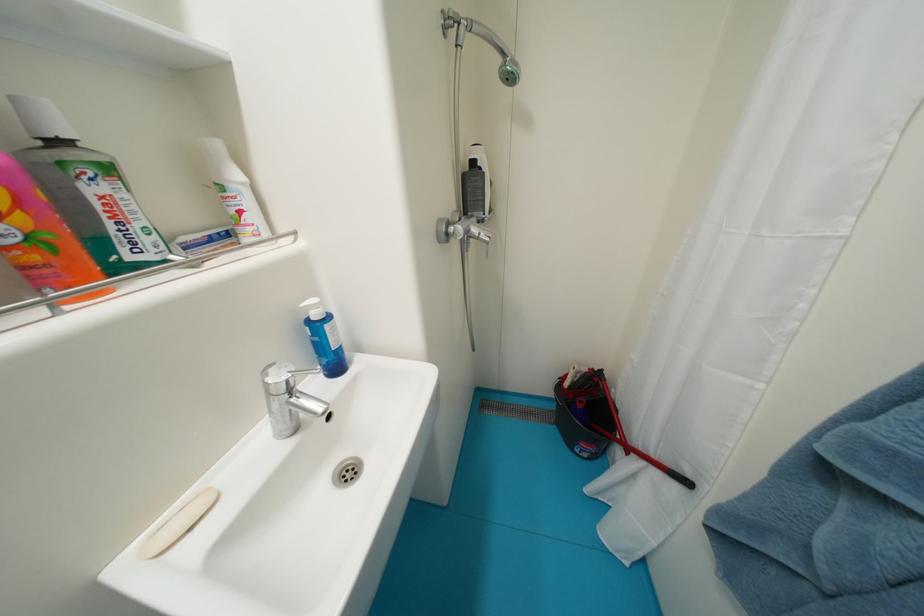
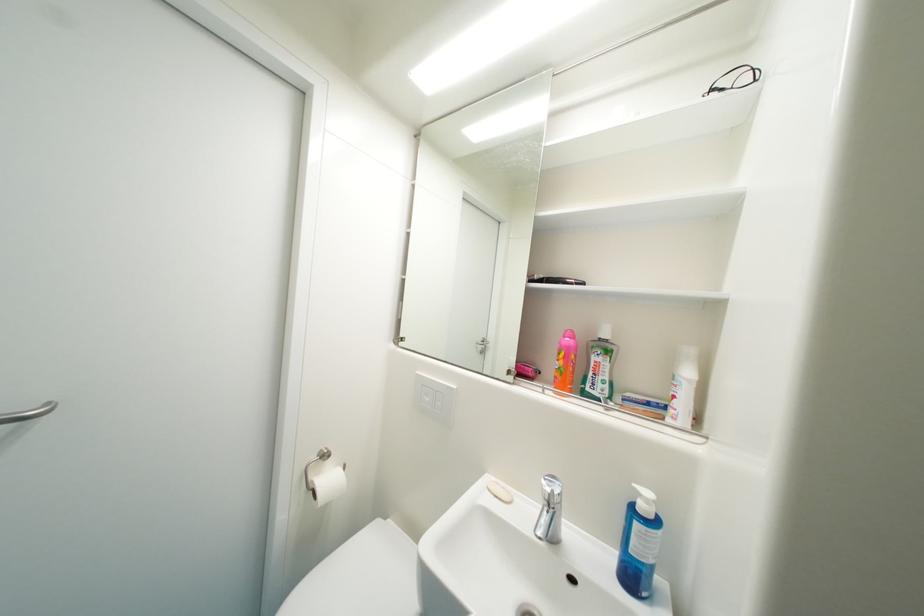
Locate, in the second image, the point that corresponds to the point at 53,238 in the first image.

(569, 371)